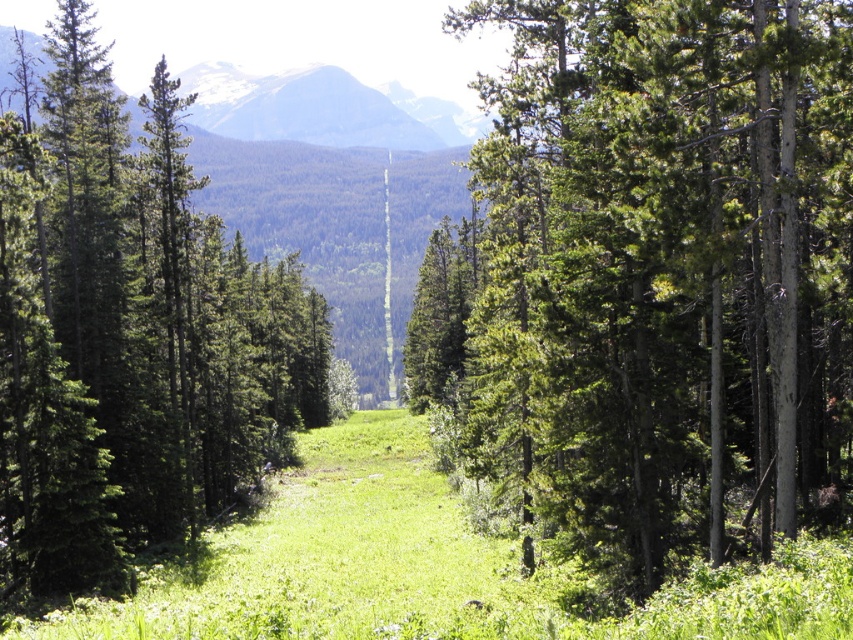
Question: Is the position of green textured tree at center more distant than that of green matte tree at left?

Choices:
 (A) no
 (B) yes

Answer: (A)

Question: Considering the real-world distances, which object is closest to the green matte tree at left?

Choices:
 (A) green textured tree at center
 (B) green grassy at center

Answer: (B)

Question: Observing the image, what is the correct spatial positioning of green textured tree at center in reference to green matte tree at left?

Choices:
 (A) below
 (B) above

Answer: (A)

Question: Which point is closer to the camera taking this photo?

Choices:
 (A) (851, 147)
 (B) (91, 260)

Answer: (A)

Question: Which object is farther from the camera taking this photo?

Choices:
 (A) green grassy at center
 (B) green matte tree at left
 (C) green textured tree at center

Answer: (B)

Question: Can you confirm if green textured tree at center is smaller than green grassy at center?

Choices:
 (A) no
 (B) yes

Answer: (A)